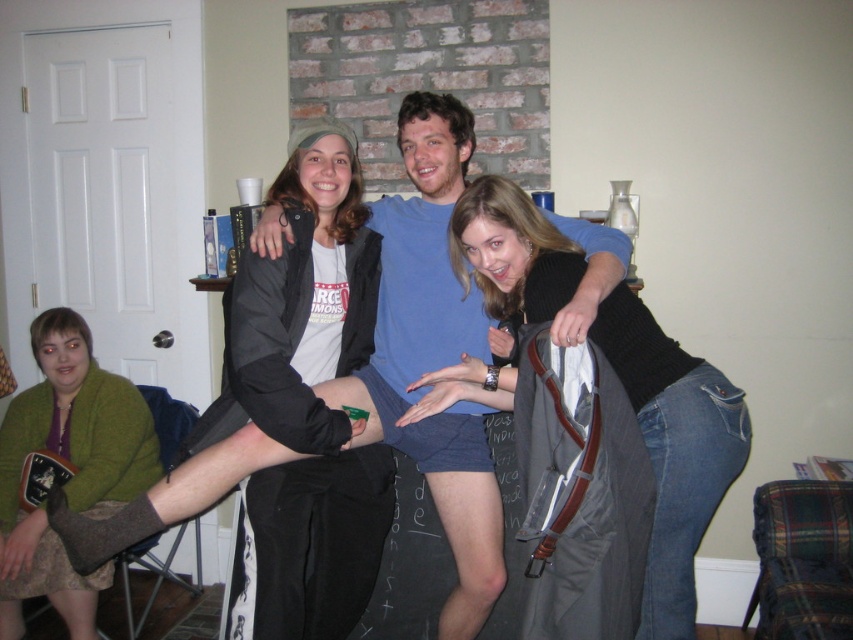
Question: Which of the following is the closest to the observer?

Choices:
 (A) (637, 330)
 (B) (466, 291)
 (C) (91, 634)

Answer: (A)

Question: Estimate the real-world distances between objects in this image. Which object is farther from the jeans at center?

Choices:
 (A) blue cotton shirt at center
 (B) green fuzzy sweater at lower left

Answer: (B)

Question: Does jeans at center have a lesser width compared to green fuzzy sweater at lower left?

Choices:
 (A) yes
 (B) no

Answer: (B)

Question: Among these points, which one is farthest from the camera?

Choices:
 (A) (650, 365)
 (B) (67, 596)

Answer: (B)

Question: Considering the relative positions of blue cotton shirt at center and jeans at center in the image provided, where is blue cotton shirt at center located with respect to jeans at center?

Choices:
 (A) above
 (B) below

Answer: (A)

Question: Does jeans at center have a larger size compared to green fuzzy sweater at lower left?

Choices:
 (A) no
 (B) yes

Answer: (B)